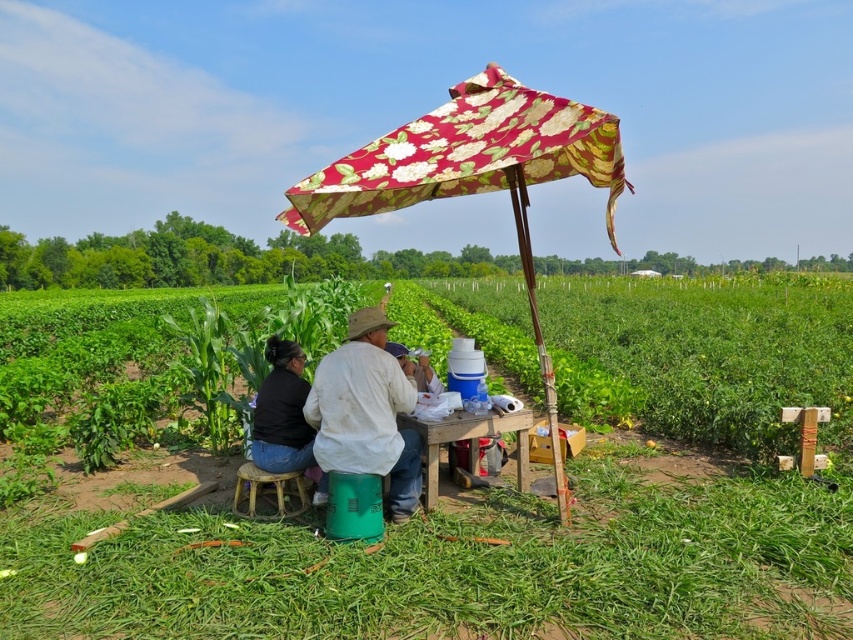
Is point (514, 428) behind point (280, 477)?

Yes.

Find the location of a particular element. wooden table at center is located at coordinates (468, 442).

Is point (473, 470) positioned before point (280, 518)?

No, it is behind (280, 518).

Identify the location of wooden table at center. (468, 442).

Can you confirm if green plastic stool at lower center is positioned to the right of wooden table at center?

No, green plastic stool at lower center is not to the right of wooden table at center.

Is point (579, 634) more distant than point (468, 445)?

No, (579, 634) is closer to viewer.

Who is more distant from viewer, (136, 506) or (476, 435)?

The point (136, 506) is behind.

This screenshot has height=640, width=853. In order to click on green plastic stool at lower center in this screenshot , I will do `click(459, 564)`.

Which is above, black fabric shirt at lower left or brown woven stool at lower center?

black fabric shirt at lower left is above.

Which of these two, black fabric shirt at lower left or brown woven stool at lower center, stands shorter?

Standing shorter between the two is brown woven stool at lower center.

Identify the location of black fabric shirt at lower left. (283, 417).